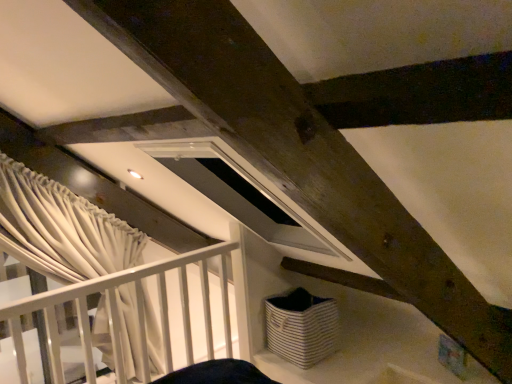
Question: From a real-world perspective, is white matte rail at left located higher than white striped fabric basket at lower center?

Choices:
 (A) yes
 (B) no

Answer: (A)

Question: Is white matte rail at left wider than white striped fabric basket at lower center?

Choices:
 (A) no
 (B) yes

Answer: (B)

Question: From a real-world perspective, is white matte rail at left beneath white striped fabric basket at lower center?

Choices:
 (A) yes
 (B) no

Answer: (B)

Question: Is white matte rail at left not near white striped fabric basket at lower center?

Choices:
 (A) no
 (B) yes

Answer: (A)

Question: Is white striped fabric basket at lower center located within white matte rail at left?

Choices:
 (A) yes
 (B) no

Answer: (B)

Question: Is white matte rail at left taller or shorter than white striped fabric basket at lower center?

Choices:
 (A) short
 (B) tall

Answer: (B)

Question: Is white matte rail at left in front of or behind white striped fabric basket at lower center in the image?

Choices:
 (A) behind
 (B) front

Answer: (B)

Question: Is white matte rail at left to the left or to the right of white striped fabric basket at lower center in the image?

Choices:
 (A) right
 (B) left

Answer: (B)

Question: Looking at the image, does white matte rail at left seem bigger or smaller compared to white striped fabric basket at lower center?

Choices:
 (A) big
 (B) small

Answer: (A)

Question: Would you say white striped fabric basket at lower center is inside or outside white matte rail at left?

Choices:
 (A) inside
 (B) outside

Answer: (B)

Question: Is point (316, 327) positioned closer to the camera than point (160, 362)?

Choices:
 (A) farther
 (B) closer

Answer: (B)

Question: From a real-world perspective, is white striped fabric basket at lower center positioned above or below white matte rail at left?

Choices:
 (A) below
 (B) above

Answer: (A)

Question: Considering the relative positions of white striped fabric basket at lower center and white matte rail at left in the image provided, is white striped fabric basket at lower center to the left or to the right of white matte rail at left?

Choices:
 (A) right
 (B) left

Answer: (A)

Question: Is white textured curtain at left to the left or to the right of white matte rail at left in the image?

Choices:
 (A) right
 (B) left

Answer: (B)

Question: Considering the positions of white textured curtain at left and white matte rail at left in the image, is white textured curtain at left wider or thinner than white matte rail at left?

Choices:
 (A) wide
 (B) thin

Answer: (B)